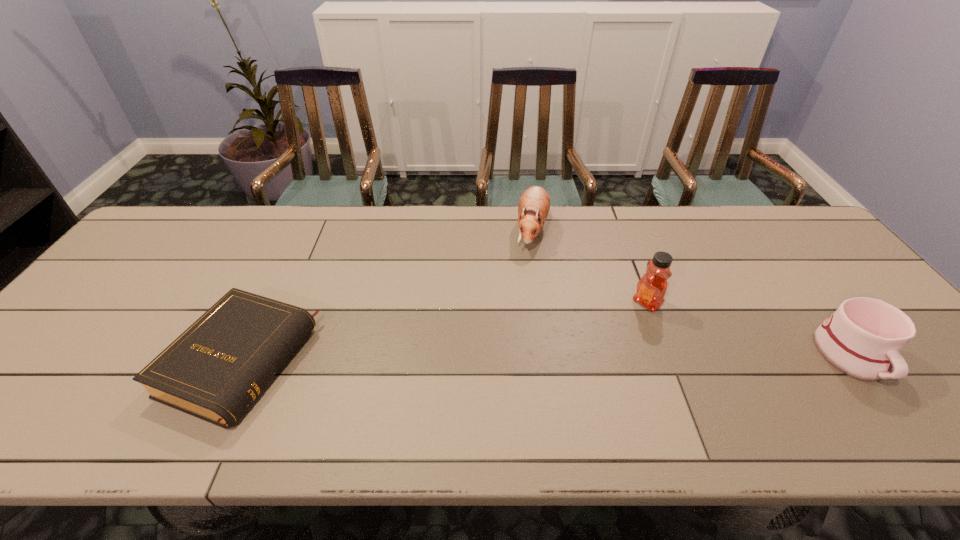
At what (x,y) coordinates should I click in order to perform the action: click on free space on the desktop that is between the shortest object and the rightmost object and is positioned on the front label of the third object from left to right. Please return your answer as a coordinate pair (x, y). Image resolution: width=960 pixels, height=540 pixels. Looking at the image, I should click on (577, 359).

Locate an element on the screen. This screenshot has width=960, height=540. free space on the desktop that is between the Bible and the rightmost object and is positioned at the face of the hamster is located at coordinates (474, 360).